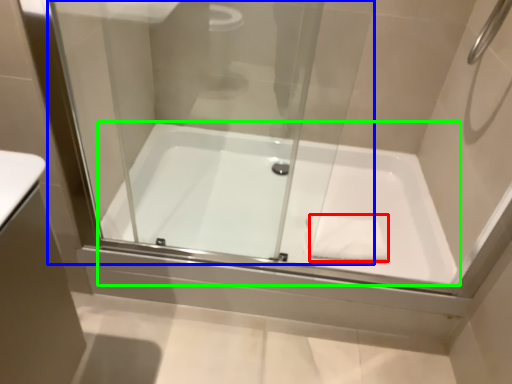
Question: Based on their relative distances, which object is farther from hand towel (highlighted by a red box)? Choose from glass door (highlighted by a blue box) and bathtub (highlighted by a green box).

Choices:
 (A) glass door
 (B) bathtub

Answer: (A)